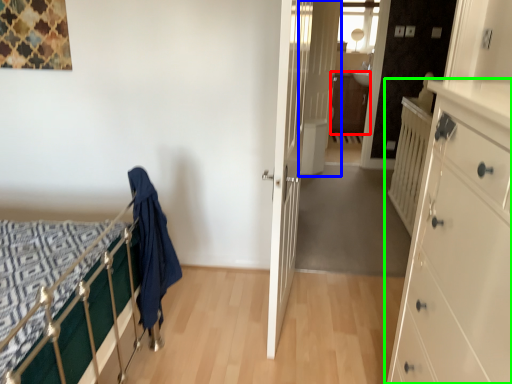
Question: Estimate the real-world distances between objects in this image. Which object is farther from file cabinet (highlighted by a red box), door (highlighted by a blue box) or chest of drawers (highlighted by a green box)?

Choices:
 (A) door
 (B) chest of drawers

Answer: (B)